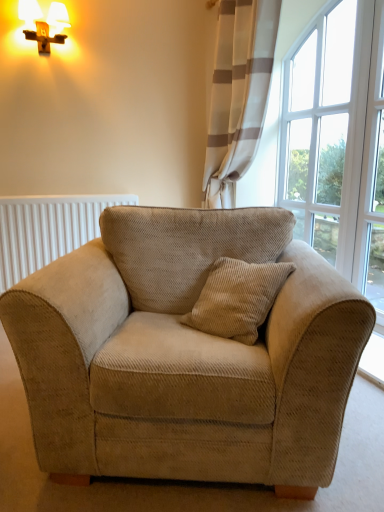
Question: From a real-world perspective, is clear glass window at upper right above or below white textured curtain at upper right?

Choices:
 (A) below
 (B) above

Answer: (A)

Question: Is clear glass window at upper right inside the boundaries of white textured curtain at upper right, or outside?

Choices:
 (A) outside
 (B) inside

Answer: (A)

Question: Based on their relative distances, which object is nearer to the white ribbed radiator at left?

Choices:
 (A) white textured curtain at upper right
 (B) matte gold table lamp at upper left
 (C) clear glass window at upper right
 (D) beige corduroy armchair at center

Answer: (A)

Question: Estimate the real-world distances between objects in this image. Which object is closer to the white ribbed radiator at left?

Choices:
 (A) beige corduroy armchair at center
 (B) matte gold table lamp at upper left
 (C) clear glass window at upper right
 (D) white textured curtain at upper right

Answer: (D)